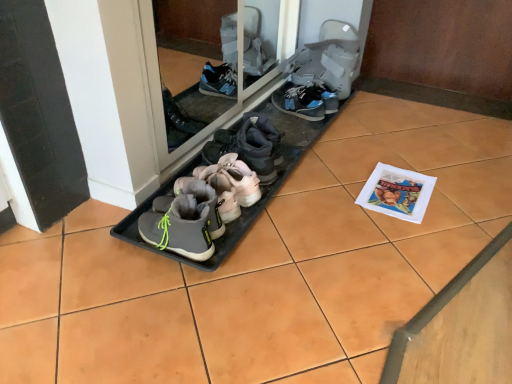
Question: Is gray suede sneaker at center, positioned as the sixth footwear in front-to-back order, not close to gray suede sneakers at center, the 5th footwear positioned from the front?

Choices:
 (A) no
 (B) yes

Answer: (A)

Question: Does gray suede sneaker at center, which appears as the second footwear when viewed from the back, come behind gray suede sneakers at center, positioned as the third footwear in back-to-front order?

Choices:
 (A) no
 (B) yes

Answer: (B)

Question: Can you confirm if gray suede sneaker at center, which appears as the second footwear when viewed from the back, is bigger than gray suede sneakers at center, positioned as the third footwear in back-to-front order?

Choices:
 (A) no
 (B) yes

Answer: (A)

Question: From a real-world perspective, is gray suede sneaker at center, which appears as the second footwear when viewed from the back, over gray suede sneakers at center, positioned as the third footwear in back-to-front order?

Choices:
 (A) yes
 (B) no

Answer: (B)

Question: Considering the relative positions of gray suede sneaker at center, positioned as the sixth footwear in front-to-back order, and gray suede sneakers at center, the 5th footwear positioned from the front, in the image provided, is gray suede sneaker at center, positioned as the sixth footwear in front-to-back order, to the left of gray suede sneakers at center, the 5th footwear positioned from the front, from the viewer's perspective?

Choices:
 (A) yes
 (B) no

Answer: (B)

Question: Does gray suede sneaker at center, which appears as the second footwear when viewed from the back, touch gray suede sneakers at center, the 5th footwear positioned from the front?

Choices:
 (A) yes
 (B) no

Answer: (B)

Question: Can you confirm if transparent glass door at center is wider than gray fabric sneakers at center, positioned as the fourth footwear in front-to-back order?

Choices:
 (A) yes
 (B) no

Answer: (B)

Question: Is transparent glass door at center far from gray fabric sneakers at center, positioned as the fourth footwear in front-to-back order?

Choices:
 (A) yes
 (B) no

Answer: (B)

Question: Is transparent glass door at center positioned with its back to gray fabric sneakers at center, positioned as the 4th footwear in back-to-front order?

Choices:
 (A) no
 (B) yes

Answer: (A)

Question: From the image's perspective, is transparent glass door at center beneath gray fabric sneakers at center, positioned as the fourth footwear in front-to-back order?

Choices:
 (A) yes
 (B) no

Answer: (B)

Question: From the image's perspective, is transparent glass door at center on top of gray fabric sneakers at center, positioned as the fourth footwear in front-to-back order?

Choices:
 (A) yes
 (B) no

Answer: (A)

Question: Is transparent glass door at center not inside gray fabric sneakers at center, positioned as the fourth footwear in front-to-back order?

Choices:
 (A) no
 (B) yes

Answer: (B)

Question: Does gray suede booties at center, acting as the seventh footwear starting from the back, have a lesser width compared to transparent glass door at center?

Choices:
 (A) no
 (B) yes

Answer: (A)